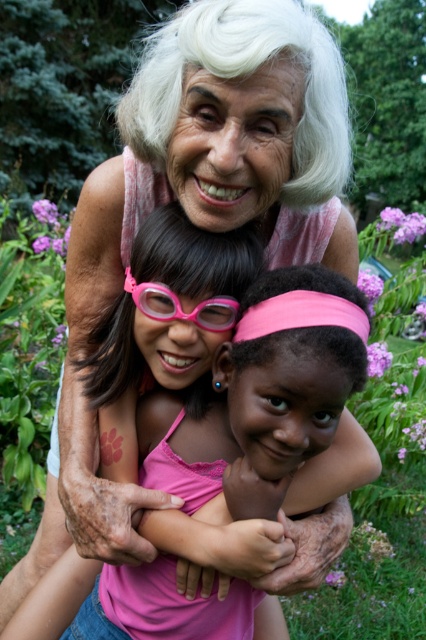
From the picture: Based on the scene description, where exactly is the pink fabric at center located in terms of coordinates?

The pink fabric at center is located at coordinates point [261,396].

Looking at the scene described, which object is positioned to the right of the other between the pink fabric at center and the pink rubber goggles at center?

The pink fabric at center is positioned to the right of the pink rubber goggles at center.

You are a photographer trying to capture a closeup of the pink fabric at center without the pink rubber goggles at center blocking the view. Is this possible based on their positions?

The pink fabric at center is in front of the pink rubber goggles at center, so the goggles will block the view of the fabric. Adjust your angle to capture the fabric without obstruction.